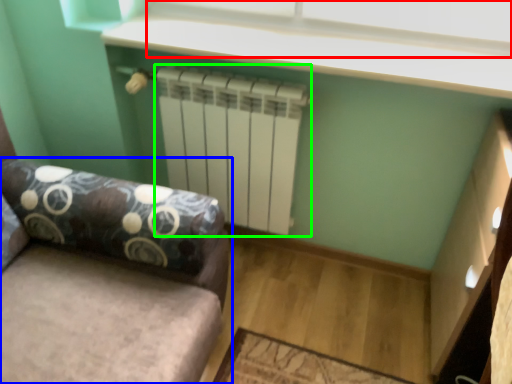
Question: Which object is positioned farthest from window screen (highlighted by a red box)? Select from studio couch (highlighted by a blue box) and radiator (highlighted by a green box).

Choices:
 (A) studio couch
 (B) radiator

Answer: (A)